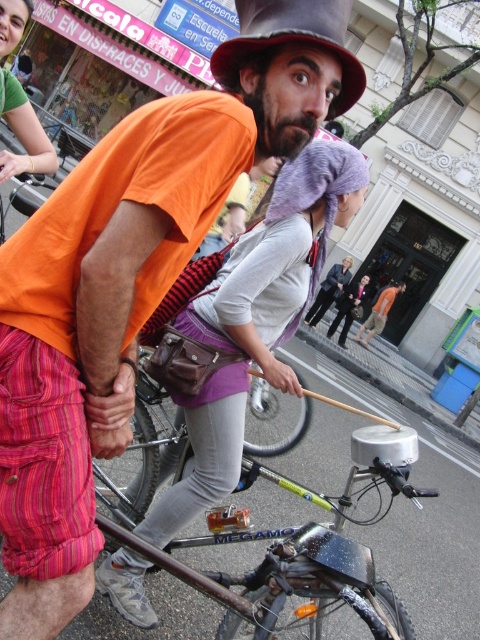
Question: Which object is closer to the camera taking this photo?

Choices:
 (A) green fabric shirt at upper left
 (B) shiny metallic hat at center

Answer: (B)

Question: Which object is the farthest from the shiny metallic hat at center?

Choices:
 (A) silver metallic bicycle at center
 (B) green fabric shirt at upper left

Answer: (B)

Question: Considering the relative positions of silver metallic bicycle at center and shiny metallic hat at center in the image provided, where is silver metallic bicycle at center located with respect to shiny metallic hat at center?

Choices:
 (A) left
 (B) right

Answer: (B)

Question: Is shiny metallic hat at center to the right of green fabric shirt at upper left from the viewer's perspective?

Choices:
 (A) yes
 (B) no

Answer: (A)

Question: Which object is the farthest from the shiny metallic hat at center?

Choices:
 (A) green fabric shirt at upper left
 (B) silver metallic bicycle at center

Answer: (A)

Question: Is shiny metallic hat at center to the right of green fabric shirt at upper left from the viewer's perspective?

Choices:
 (A) no
 (B) yes

Answer: (B)